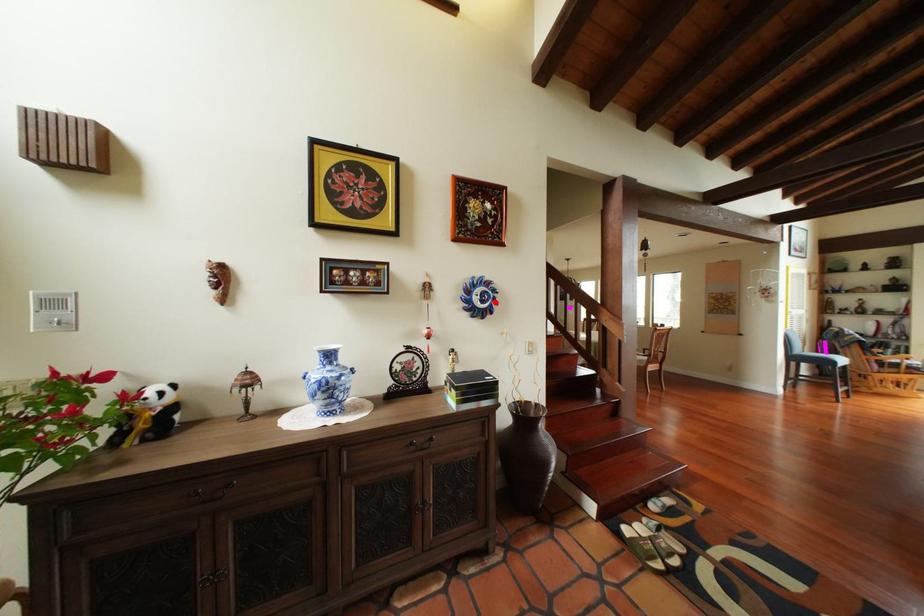
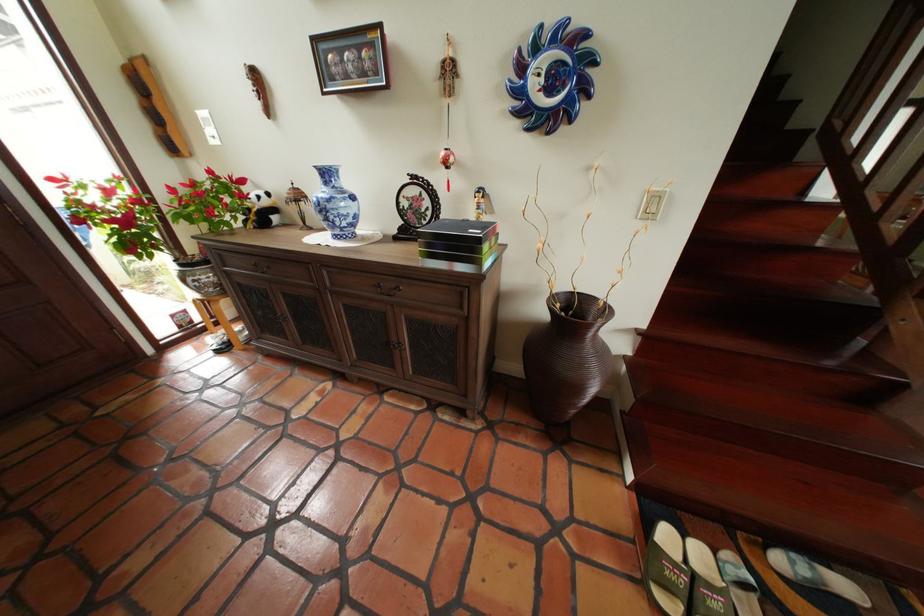
Where in the second image is the point corresponding to the highlighted location from the first image?

(563, 91)